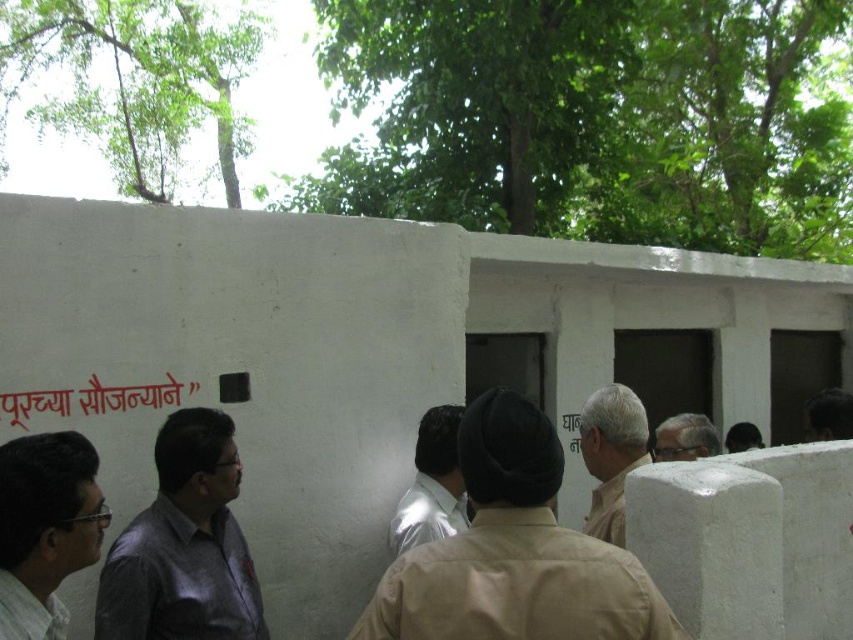
Question: Which point is closer to the camera taking this photo?

Choices:
 (A) (646, 438)
 (B) (849, 433)

Answer: (A)

Question: Which point is farther to the camera?

Choices:
 (A) dark brown hair at center
 (B) dark gray shirt at center
 (C) red painted text at lower left
 (D) shiny white shirt at center

Answer: (A)

Question: Is beige fabric hat at center below beige fabric headscarf at center?

Choices:
 (A) yes
 (B) no

Answer: (B)

Question: Can you confirm if beige fabric hat at center is thinner than light beige fabric turban at center?

Choices:
 (A) yes
 (B) no

Answer: (B)

Question: Is beige fabric hat at center further to camera compared to red painted text at lower left?

Choices:
 (A) no
 (B) yes

Answer: (A)

Question: Which of the following is the closest to the observer?

Choices:
 (A) beige fabric headscarf at center
 (B) beige fabric hat at center

Answer: (B)